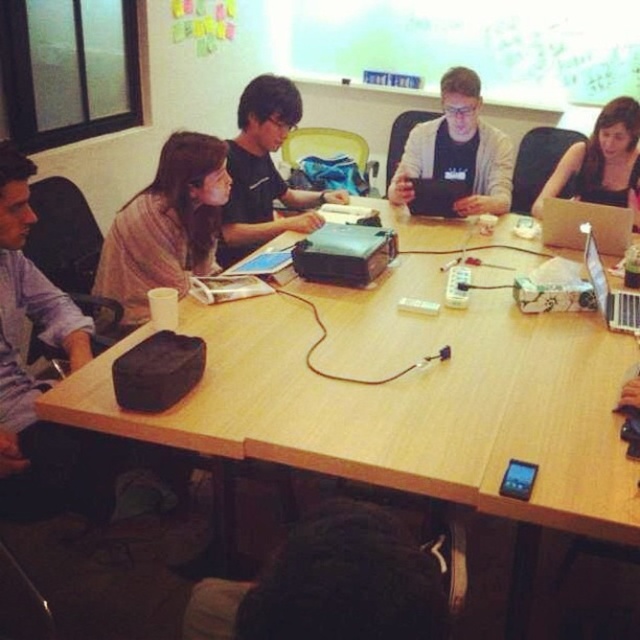
You are organizing cables for a presentation and need to access both the matte black laptop at upper right and the silver metallic laptop at upper right. Which laptop should you move first to reach the one underneath without disturbing the other?

The matte black laptop at upper right should be moved first because it is located above the silver metallic laptop at upper right, allowing access to the one underneath without disturbing it.

You need to place a large presentation folder on the table. Given the current items on the wooden table at center and the matte black laptop at center, which object should you move to make space?

Since the wooden table at center is larger than the matte black laptop at center, you should move the matte black laptop at center to create space for the presentation folder.